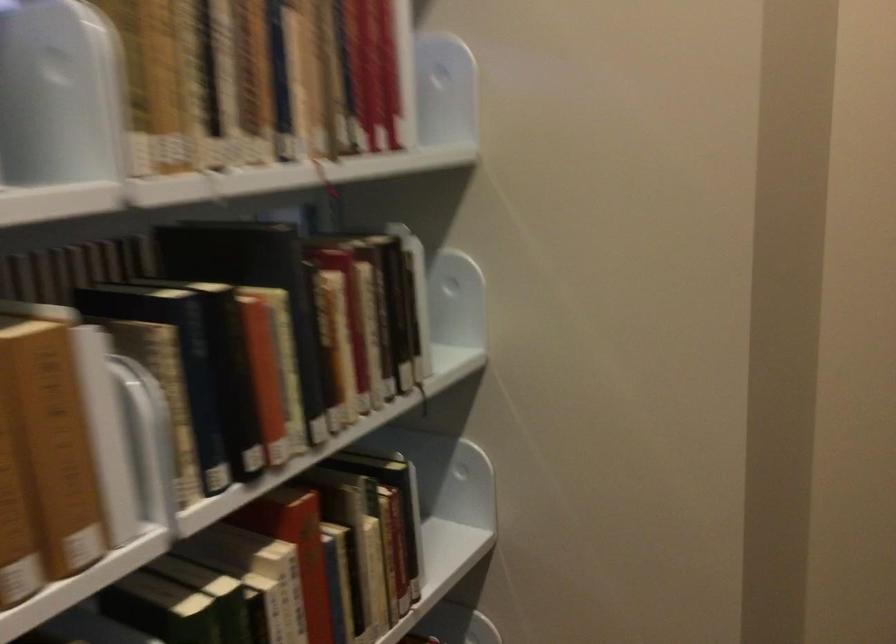
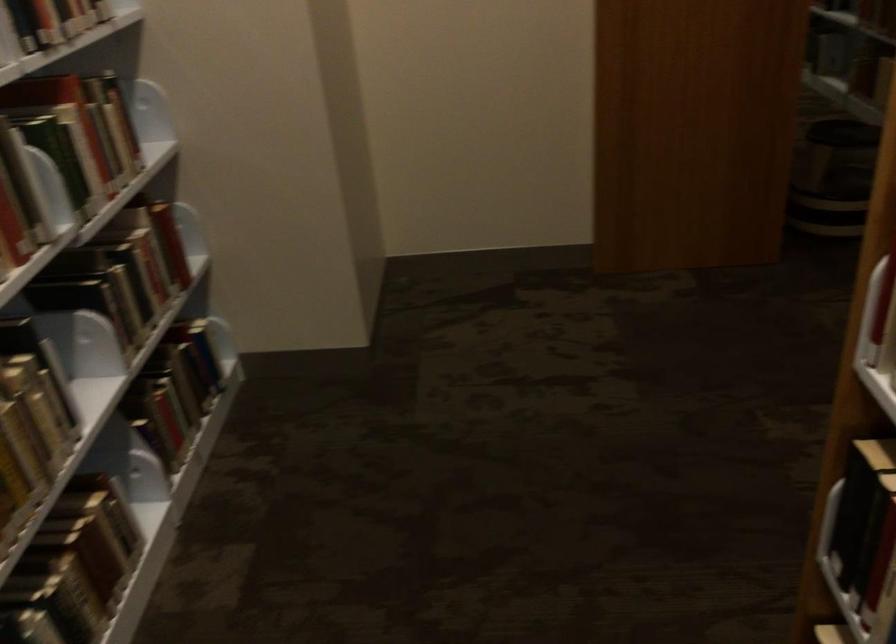
The images are taken continuously from a first-person perspective. In which direction is your viewpoint rotating?

The rotation direction of the camera is right-down.